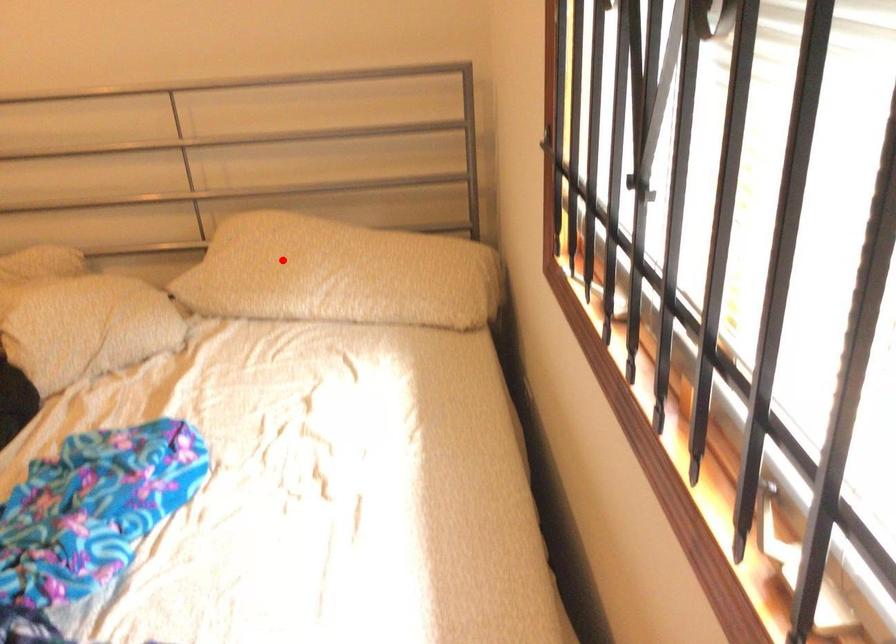
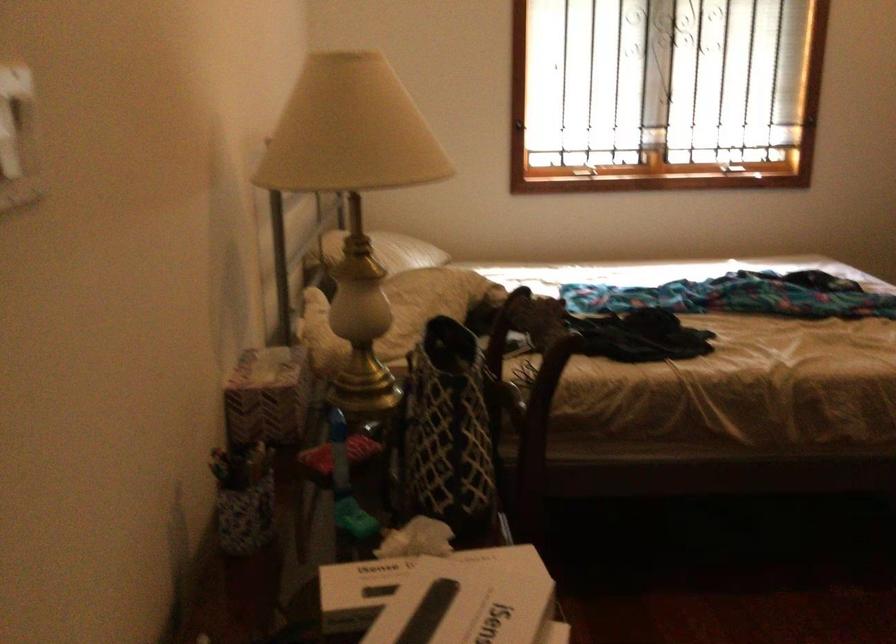
Question: I am providing you with two images of the same scene from different viewpoints. A red point is shown in image1. For the corresponding object point in image2, is it positioned nearer or farther from the camera?

Choices:
 (A) Nearer
 (B) Farther

Answer: (B)